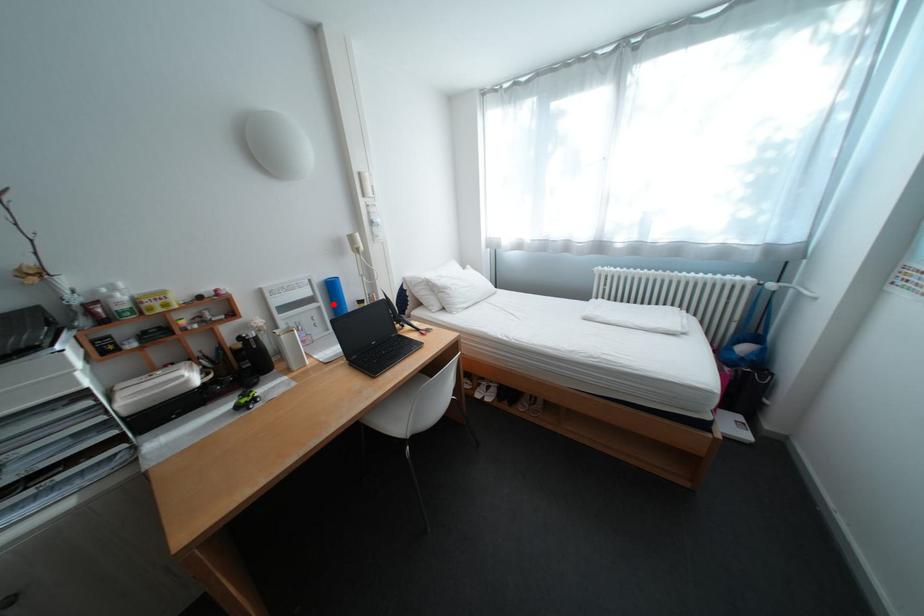
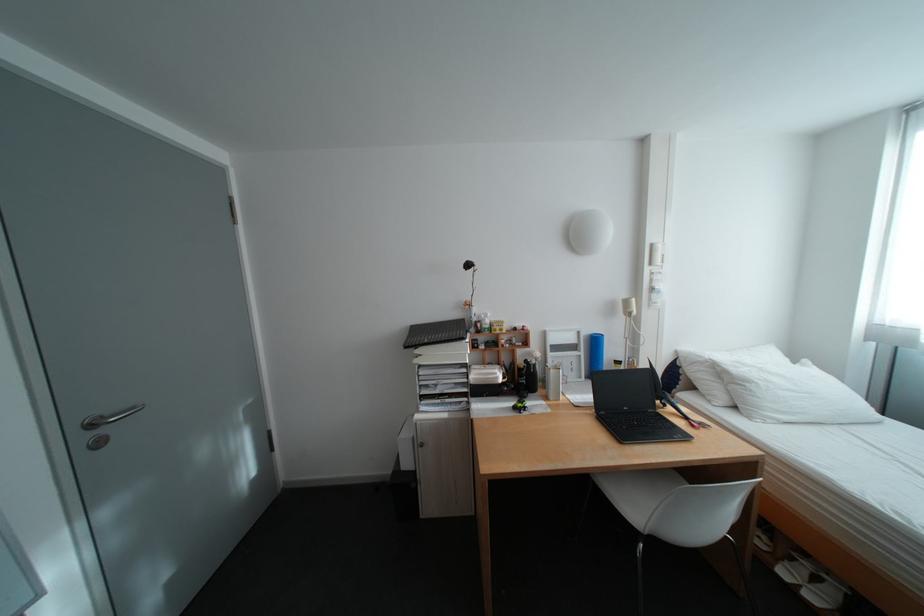
In the second image, find the point that corresponds to the highlighted location in the first image.

(594, 354)